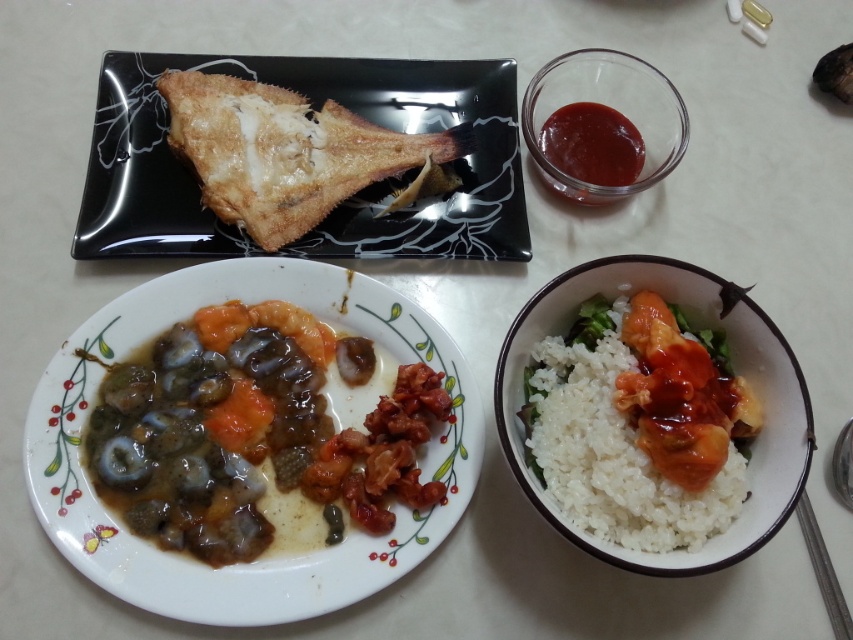
Question: Which point appears closest to the camera in this image?

Choices:
 (A) (640, 68)
 (B) (589, 116)
 (C) (396, 442)
 (D) (422, 220)

Answer: (C)

Question: Which point is farther from the camera taking this photo?

Choices:
 (A) (225, 332)
 (B) (558, 156)
 (C) (566, 92)

Answer: (C)

Question: Does golden brown fried fish at upper left lie in front of white matte rice at lower right?

Choices:
 (A) yes
 (B) no

Answer: (B)

Question: Can you confirm if shiny brown seafood at center left is bigger than golden brown fried fish at upper left?

Choices:
 (A) no
 (B) yes

Answer: (A)

Question: Does white matte rice at lower right appear on the right side of smooth glossy tomato sauce at upper right?

Choices:
 (A) yes
 (B) no

Answer: (A)

Question: Among these objects, which one is farthest from the camera?

Choices:
 (A) white matte rice at lower right
 (B) golden brown fried fish at upper left

Answer: (B)